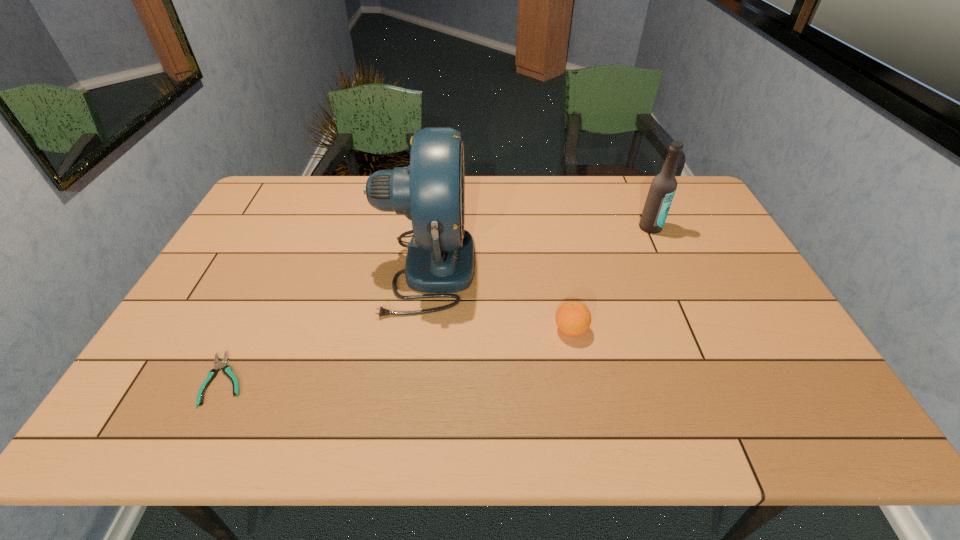
Locate an element on the screen. This screenshot has width=960, height=540. free space between the leftmost object and the fan is located at coordinates (325, 323).

This screenshot has height=540, width=960. I want to click on empty space that is in between the leftmost object and the fan, so click(325, 323).

This screenshot has height=540, width=960. In order to click on unoccupied area between the nearest object and the third object from left to right in this screenshot , I will do pyautogui.click(x=398, y=354).

Where is `unoccupied position between the leftmost object and the orange`? unoccupied position between the leftmost object and the orange is located at coordinates [x=398, y=354].

The image size is (960, 540). Identify the location of unoccupied area between the third object from left to right and the fan. (498, 299).

Identify the location of unoccupied area between the pliers and the fan. (325, 323).

You are a GUI agent. You are given a task and a screenshot of the screen. Output one action in this format:
    pyautogui.click(x=<x>, y=<y>)
    Task: Click on the vacant space that is in between the shortest object and the third object from left to right
    
    Given the screenshot: What is the action you would take?
    pyautogui.click(x=398, y=354)

Identify the location of vacant space that's between the beer bottle and the third tallest object. [x=611, y=279].

Image resolution: width=960 pixels, height=540 pixels. In order to click on vacant space in between the second shortest object and the nearest object in this screenshot , I will do `click(398, 354)`.

Identify which object is located as the third nearest to the shortest object. Please provide its 2D coordinates. Your answer should be formatted as a tuple, i.e. [(x, y)], where the tuple contains the x and y coordinates of a point satisfying the conditions above.

[(663, 187)]